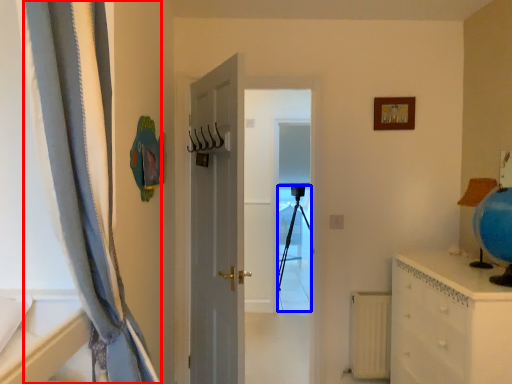
Question: Which point is further to the camera, curtain (highlighted by a red box) or tripod (highlighted by a blue box)?

Choices:
 (A) curtain
 (B) tripod

Answer: (B)